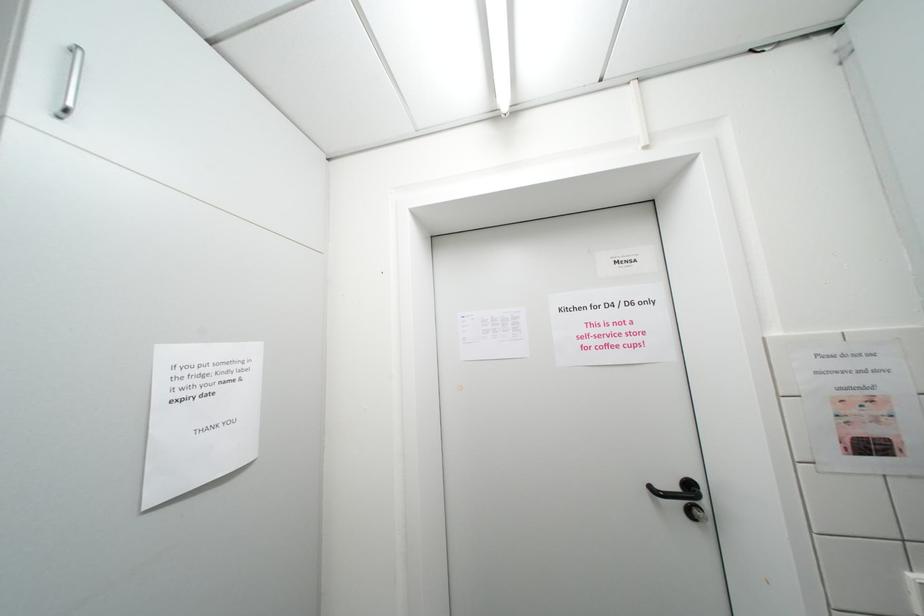
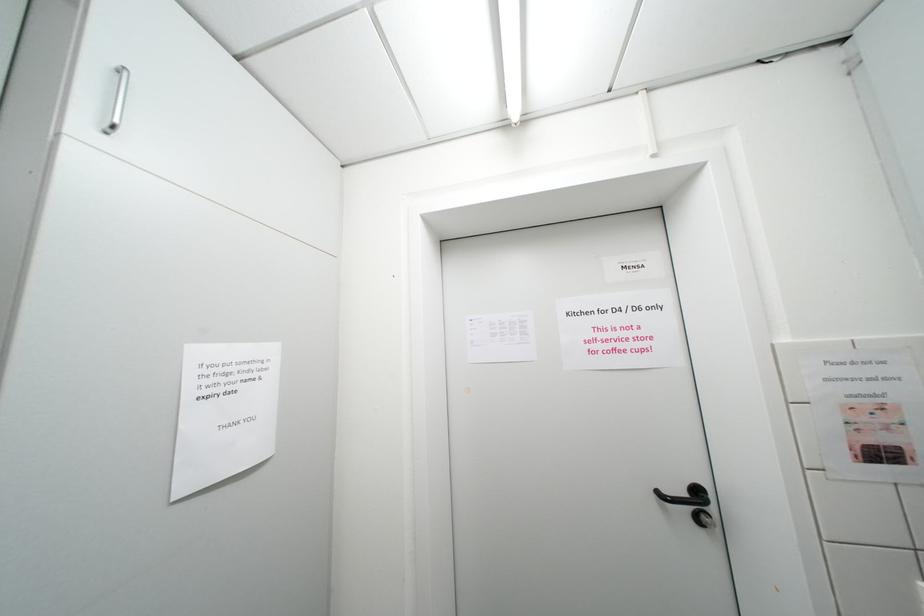
Question: The images are taken continuously from a first-person perspective. In which direction is your viewpoint rotating?

Choices:
 (A) Left
 (B) Right
 (C) Up
 (D) Down

Answer: (A)